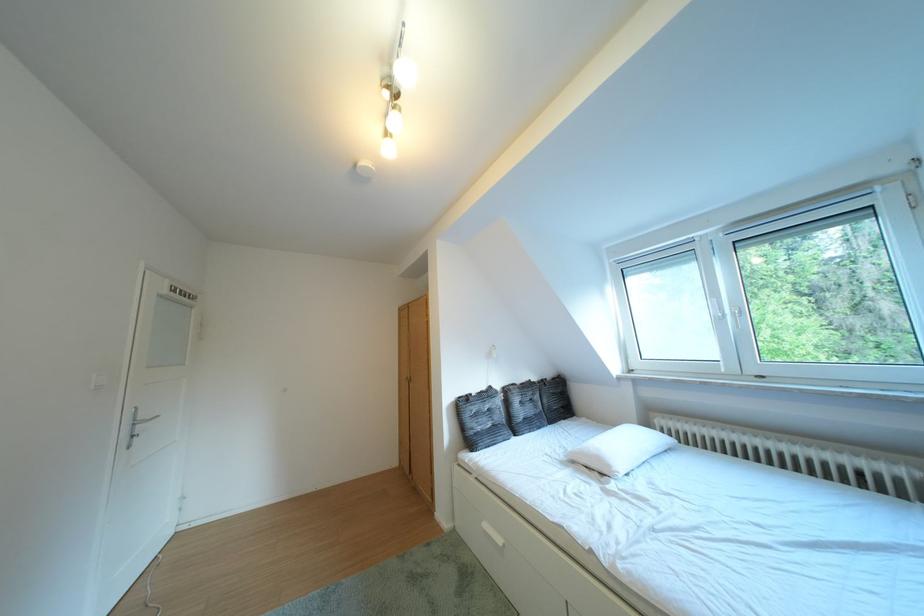
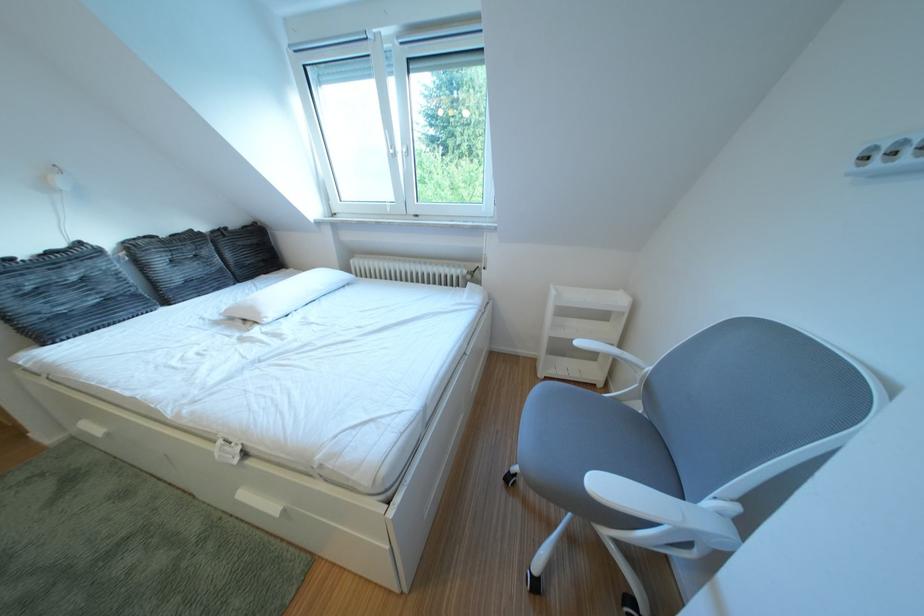
Locate, in the second image, the point that corresponds to the point at 504,392 in the first image.

(93, 249)